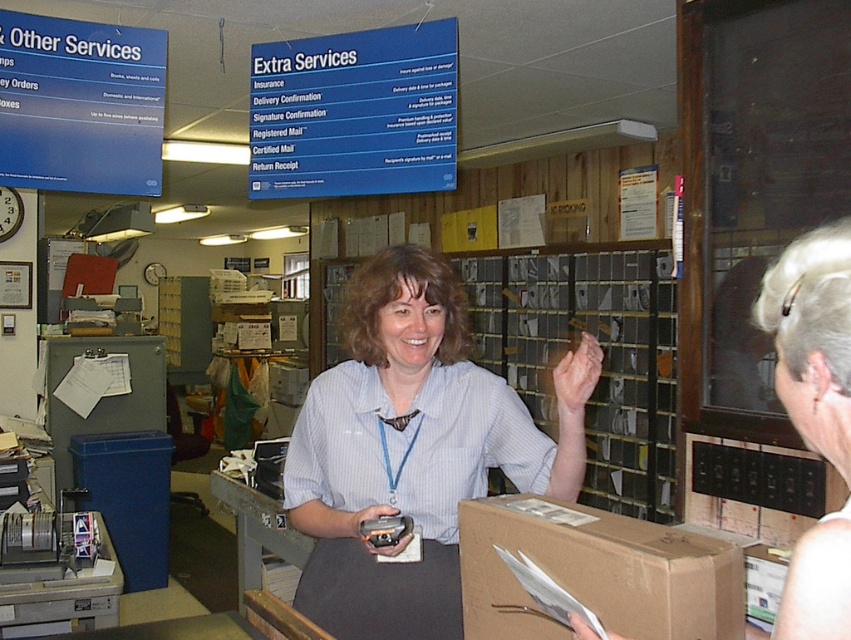
Question: Can you confirm if white striped shirt at center is thinner than brown cardboard box at lower center?

Choices:
 (A) no
 (B) yes

Answer: (A)

Question: Is white striped shirt at center to the left of brown cardboard box at lower center from the viewer's perspective?

Choices:
 (A) yes
 (B) no

Answer: (A)

Question: Does white striped shirt at center have a smaller size compared to brown cardboard box at lower center?

Choices:
 (A) no
 (B) yes

Answer: (A)

Question: Which object appears closest to the camera in this image?

Choices:
 (A) white striped shirt at center
 (B) brown cardboard box at lower center

Answer: (B)

Question: Among these points, which one is farthest from the camera?

Choices:
 (A) (464, 304)
 (B) (535, 538)

Answer: (A)

Question: Which of the following is the farthest from the observer?

Choices:
 (A) (717, 628)
 (B) (410, 595)

Answer: (B)